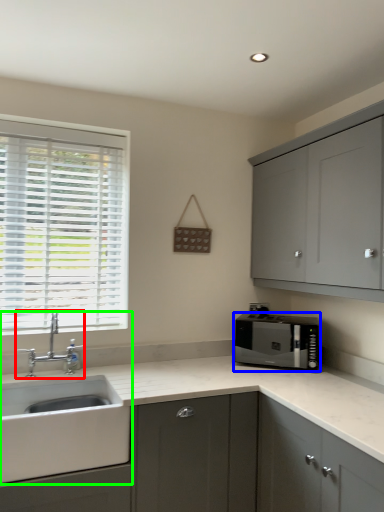
Question: Considering the real-world distances, which object is farthest from tap (highlighted by a red box)? microwave oven (highlighted by a blue box) or sink (highlighted by a green box)?

Choices:
 (A) microwave oven
 (B) sink

Answer: (A)